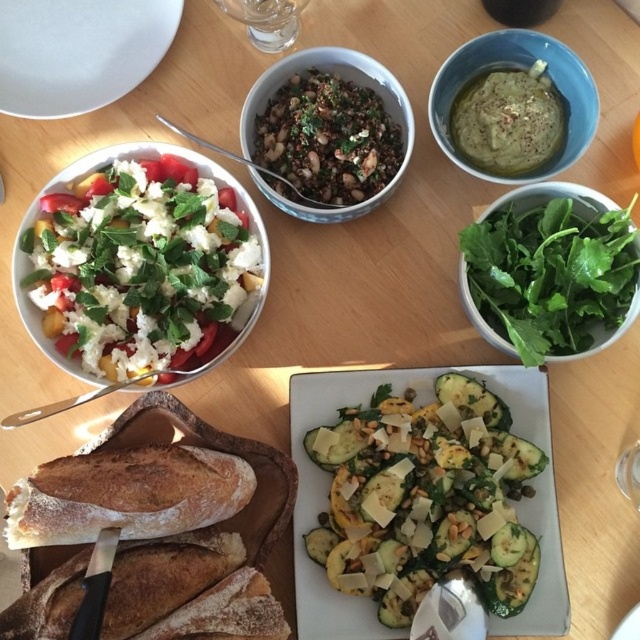
Is point (625, 307) behind point (499, 44)?

No, it is in front of (499, 44).

Which is below, green leafy salad at upper right or green matte hummus at upper right?

green leafy salad at upper right is below.

Does point (470, 308) lie behind point (445, 120)?

That is False.

This screenshot has width=640, height=640. I want to click on green leafy salad at upper right, so click(550, 273).

Is point (625, 220) positioned in front of point (140, 499)?

That is False.

Does green leafy salad at upper right lie in front of brown crusty bread at lower left?

That is False.

This screenshot has width=640, height=640. I want to click on green leafy salad at upper right, so click(x=550, y=273).

Is brown crusty bread at lower left further to camera compared to white matte plate at upper left?

No.

Is brown crusty bread at lower left taller than white matte plate at upper left?

No, brown crusty bread at lower left is not taller than white matte plate at upper left.

Is point (218, 497) farther from viewer compared to point (6, 24)?

That is False.

You are a GUI agent. You are given a task and a screenshot of the screen. Output one action in this format:
    pyautogui.click(x=<x>, y=<y>)
    Task: Click on the brown crusty bread at lower left
    This screenshot has width=640, height=640.
    Given the screenshot: What is the action you would take?
    pyautogui.click(x=125, y=493)